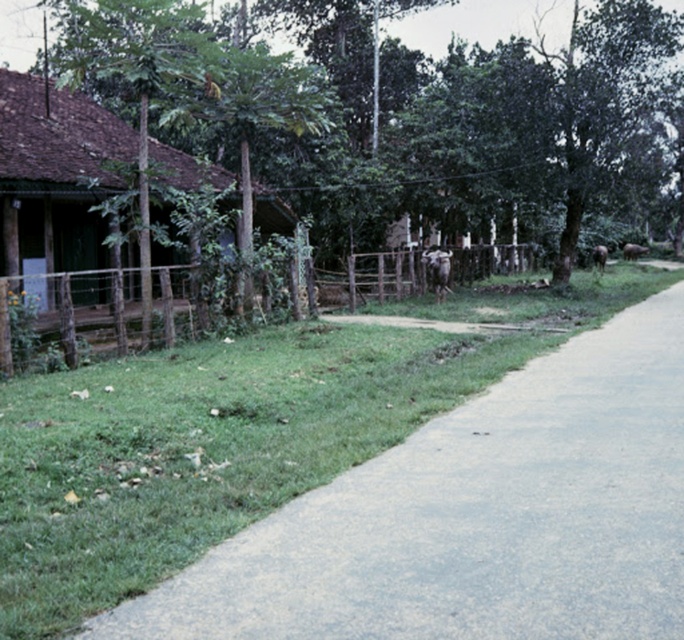
Which is more to the left, brown furry cow at right or brown furry cow at center-right?

Positioned to the left is brown furry cow at center-right.

Does brown furry cow at right have a greater width compared to brown furry cow at center-right?

Indeed, brown furry cow at right has a greater width compared to brown furry cow at center-right.

Does point (642, 253) come farther from viewer compared to point (591, 252)?

Yes.

Find the location of a particular element. The image size is (684, 640). brown furry cow at right is located at coordinates (633, 250).

Is brown furry cow at center taller than brown furry cow at center-right?

No, brown furry cow at center is not taller than brown furry cow at center-right.

I want to click on brown furry cow at center, so click(436, 269).

Which is behind, point (438, 257) or point (592, 266)?

The point (592, 266) is behind.

Where is `brown furry cow at center`? This screenshot has height=640, width=684. brown furry cow at center is located at coordinates (436, 269).

How much distance is there between brown thatched hut at left and brown furry cow at center-right?

brown thatched hut at left is 71.38 feet from brown furry cow at center-right.

In order to click on brown thatched hut at left in this screenshot , I will do `click(55, 176)`.

Does point (88, 120) lie in front of point (591, 259)?

Yes, point (88, 120) is in front of point (591, 259).

Identify the location of brown thatched hut at left. (55, 176).